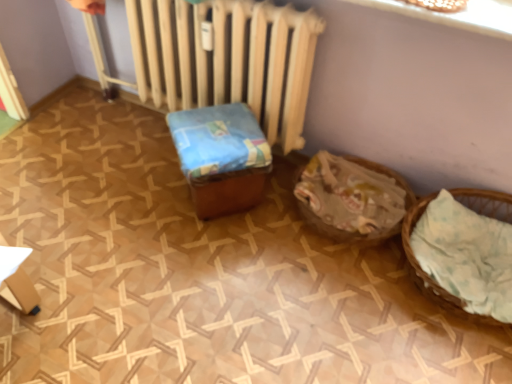
Where is `blank space to the left of blue fabric-covered box at center`? blank space to the left of blue fabric-covered box at center is located at coordinates (147, 196).